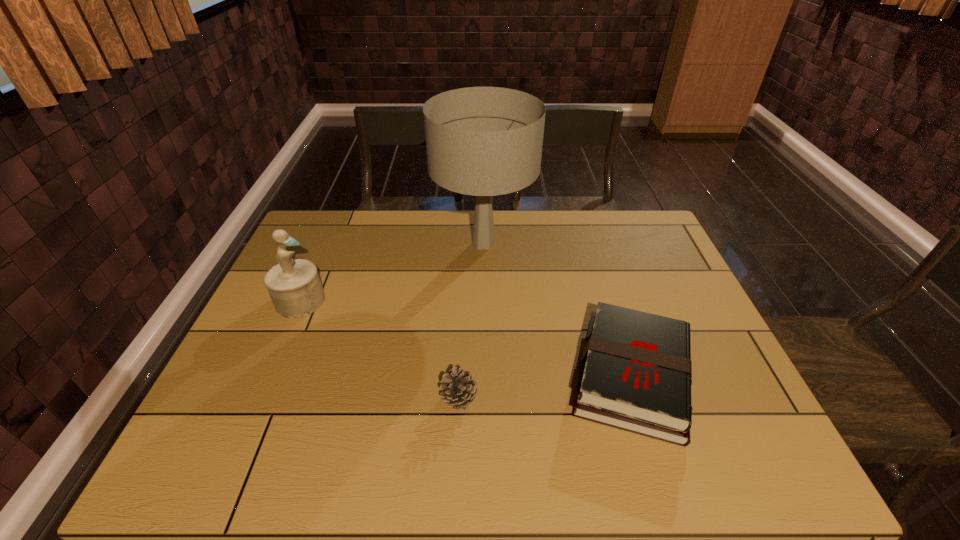
Where is `free space located 0.310m on the left of the pinecone`? The height and width of the screenshot is (540, 960). free space located 0.310m on the left of the pinecone is located at coordinates (302, 397).

I want to click on vacant area located on the left of the hardback book, so click(x=449, y=376).

Locate an element on the screen. The height and width of the screenshot is (540, 960). object that is at the far edge is located at coordinates (483, 141).

The height and width of the screenshot is (540, 960). Identify the location of object that is at the near edge. (636, 371).

Identify the location of object positioned at the left edge. This screenshot has height=540, width=960. 294,286.

Locate an element on the screen. This screenshot has height=540, width=960. object located at the right edge is located at coordinates (636, 371).

You are a GUI agent. You are given a task and a screenshot of the screen. Output one action in this format:
    pyautogui.click(x=<x>, y=<y>)
    Task: Click on the object that is at the near right corner
    
    Given the screenshot: What is the action you would take?
    pyautogui.click(x=636, y=371)

The width and height of the screenshot is (960, 540). I want to click on free point at the far edge, so click(x=564, y=244).

At what (x,y) coordinates should I click in order to perform the action: click on free space at the near edge of the desktop. Please return your answer as a coordinate pair (x, y). Looking at the image, I should click on (343, 467).

This screenshot has width=960, height=540. I want to click on vacant area at the right edge, so click(717, 341).